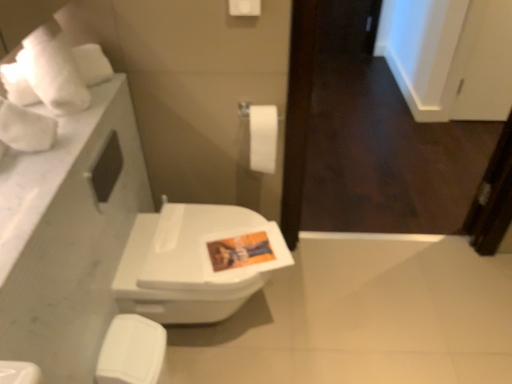
The width and height of the screenshot is (512, 384). I want to click on free spot below white glossy toilet at center (from a real-world perspective), so click(221, 328).